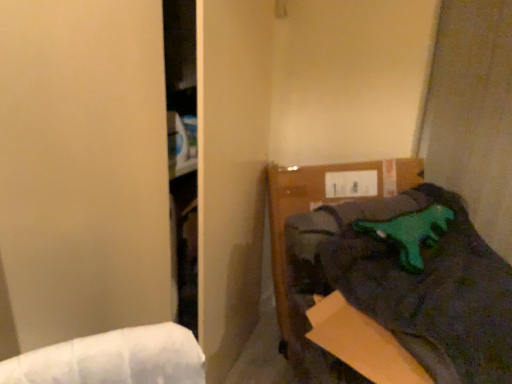
Question: Can you confirm if green rubber dinosaur at upper right is taller than green plastic dinosaur at upper right?

Choices:
 (A) yes
 (B) no

Answer: (B)

Question: From the image's perspective, is green rubber dinosaur at upper right located above green plastic dinosaur at upper right?

Choices:
 (A) no
 (B) yes

Answer: (B)

Question: From a real-world perspective, is green rubber dinosaur at upper right over green plastic dinosaur at upper right?

Choices:
 (A) no
 (B) yes

Answer: (B)

Question: Are green rubber dinosaur at upper right and green plastic dinosaur at upper right making contact?

Choices:
 (A) yes
 (B) no

Answer: (B)

Question: From the image's perspective, does green rubber dinosaur at upper right appear lower than green plastic dinosaur at upper right?

Choices:
 (A) yes
 (B) no

Answer: (B)

Question: Is green rubber dinosaur at upper right oriented towards green plastic dinosaur at upper right?

Choices:
 (A) yes
 (B) no

Answer: (A)

Question: Can you confirm if green plastic dinosaur at upper right is positioned to the right of green rubber dinosaur at upper right?

Choices:
 (A) yes
 (B) no

Answer: (A)

Question: Is green plastic dinosaur at upper right oriented towards green rubber dinosaur at upper right?

Choices:
 (A) no
 (B) yes

Answer: (A)

Question: Can you confirm if green plastic dinosaur at upper right is thinner than green rubber dinosaur at upper right?

Choices:
 (A) yes
 (B) no

Answer: (B)

Question: Does green plastic dinosaur at upper right have a greater width compared to green rubber dinosaur at upper right?

Choices:
 (A) no
 (B) yes

Answer: (B)

Question: Is green plastic dinosaur at upper right positioned in front of green rubber dinosaur at upper right?

Choices:
 (A) no
 (B) yes

Answer: (B)

Question: Is green rubber dinosaur at upper right at the back of green plastic dinosaur at upper right?

Choices:
 (A) no
 (B) yes

Answer: (A)

Question: Considering the relative positions of green rubber dinosaur at upper right and green plastic dinosaur at upper right in the image provided, is green rubber dinosaur at upper right to the left or to the right of green plastic dinosaur at upper right?

Choices:
 (A) right
 (B) left

Answer: (B)